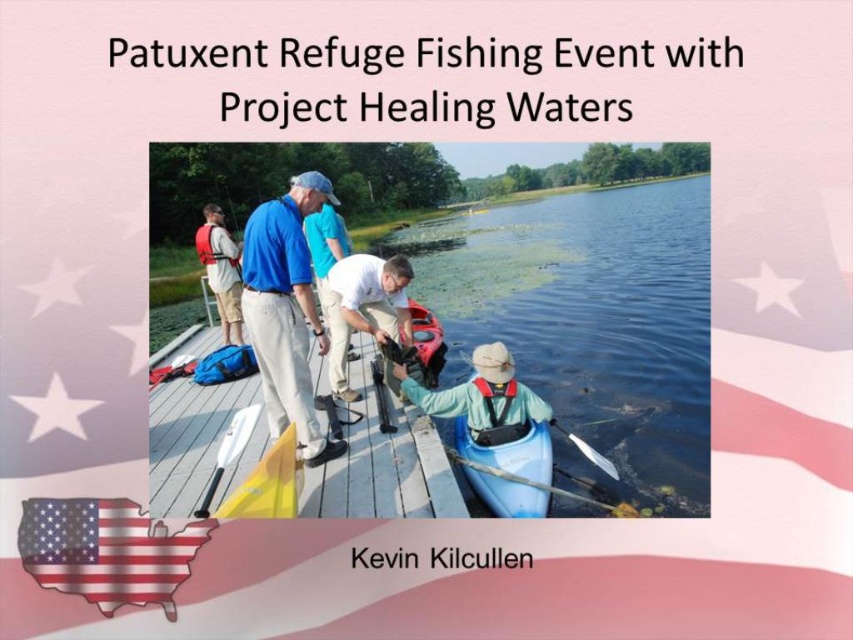
You are a photographer positioned at the edge of the dock. You want to capture a photo of the blue cotton shirt at center and the white plastic paddle at center. Which object should you focus on first to ensure it appears sharp in the photo?

You should focus on the blue cotton shirt at center first because it is closer to you than the white plastic paddle at center, ensuring it will be sharp while the paddle may appear slightly blurry if not adjusted.

You are a photographer at the Patuxent Refuge fishing event. You want to take a photo of the blue plastic kayak at lower center and the american flag at lower left. From the photographer perspective, which object is closer to the camera?

The blue plastic kayak at lower center is closer to the camera because it is positioned above the american flag at lower left, which means it is in front of the flag in the scene.

You are a photographer standing on the dock at Patuxent Refuge. You want to take a photo of the blue plastic kayak at lower center and the american flag at lower left. Which object will appear larger in your photo?

The blue plastic kayak at lower center will appear larger in the photo because it is much taller than the american flag at lower left.